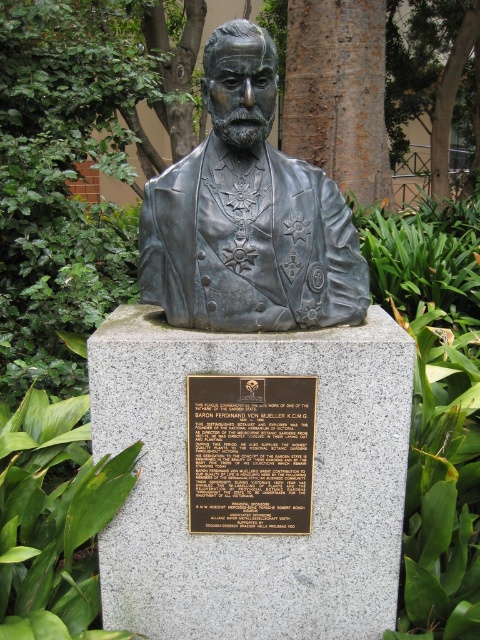
Question: Is bronze bust at center wider than bronze plaque at center?

Choices:
 (A) no
 (B) yes

Answer: (B)

Question: Which of the following is the closest to the observer?

Choices:
 (A) tap(212, 33)
 (B) tap(195, 426)
 (C) tap(300, 16)

Answer: (B)

Question: Which point is closer to the camera taking this photo?

Choices:
 (A) (199, 452)
 (B) (412, 81)
 (C) (144, 284)

Answer: (A)

Question: Which of these objects is positioned farthest from the bronze plaque at center?

Choices:
 (A) brown rough bark tree at center
 (B) green leafy tree at upper center
 (C) bronze statue at center

Answer: (B)

Question: Does bronze statue at center have a lesser width compared to brown rough bark tree at center?

Choices:
 (A) yes
 (B) no

Answer: (A)

Question: Is bronze statue at center above green leafy tree at upper center?

Choices:
 (A) yes
 (B) no

Answer: (B)